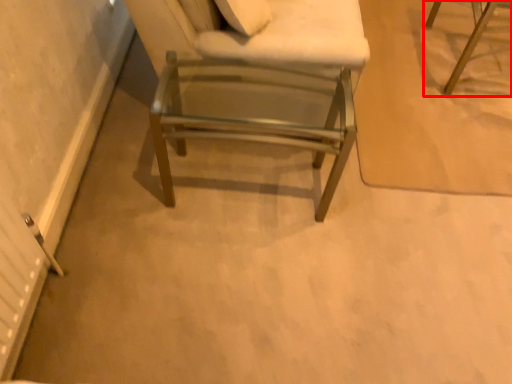
Question: In this image, where is chair (annotated by the red box) located relative to chair?

Choices:
 (A) right
 (B) left

Answer: (A)